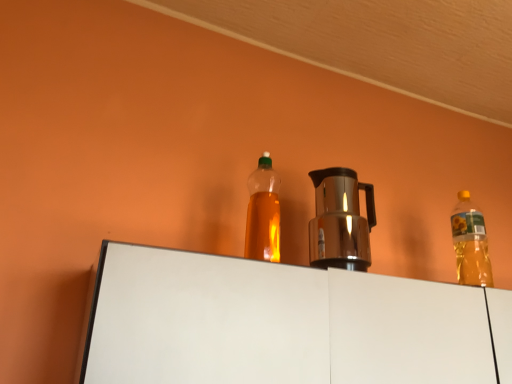
Question: Considering the relative positions of translucent plastic bottle at upper right, the 2th bottle when ordered from left to right, and shiny metallic coffee pot at center in the image provided, is translucent plastic bottle at upper right, the 2th bottle when ordered from left to right, to the left of shiny metallic coffee pot at center from the viewer's perspective?

Choices:
 (A) yes
 (B) no

Answer: (B)

Question: Is translucent plastic bottle at upper right, the 2th bottle when ordered from left to right, in contact with shiny metallic coffee pot at center?

Choices:
 (A) yes
 (B) no

Answer: (B)

Question: Is translucent plastic bottle at upper right, the 2th bottle viewed from the front, bigger than shiny metallic coffee pot at center?

Choices:
 (A) yes
 (B) no

Answer: (B)

Question: Can you confirm if translucent plastic bottle at upper right, the first bottle when ordered from right to left, is thinner than shiny metallic coffee pot at center?

Choices:
 (A) yes
 (B) no

Answer: (A)

Question: From the image's perspective, is translucent plastic bottle at upper right, the first bottle when ordered from right to left, on top of shiny metallic coffee pot at center?

Choices:
 (A) yes
 (B) no

Answer: (B)

Question: Is translucent plastic bottle at upper right, the 2th bottle when ordered from left to right, behind shiny metallic coffee pot at center?

Choices:
 (A) yes
 (B) no

Answer: (A)

Question: From the image's perspective, does shiny metallic coffee pot at center appear higher than translucent plastic bottle at upper right, the 2th bottle viewed from the front?

Choices:
 (A) no
 (B) yes

Answer: (B)

Question: Is shiny metallic coffee pot at center facing away from translucent plastic bottle at upper right, the 2th bottle when ordered from left to right?

Choices:
 (A) no
 (B) yes

Answer: (A)

Question: Does shiny metallic coffee pot at center appear on the left side of translucent plastic bottle at upper right, the 2th bottle viewed from the front?

Choices:
 (A) no
 (B) yes

Answer: (B)

Question: Does shiny metallic coffee pot at center come in front of translucent plastic bottle at upper right, the 1th bottle from the back?

Choices:
 (A) no
 (B) yes

Answer: (B)

Question: Can you confirm if shiny metallic coffee pot at center is bigger than translucent plastic bottle at upper right, the 2th bottle viewed from the front?

Choices:
 (A) yes
 (B) no

Answer: (A)

Question: Is shiny metallic coffee pot at center not inside translucent plastic bottle at upper right, the first bottle when ordered from right to left?

Choices:
 (A) no
 (B) yes

Answer: (B)

Question: From the image's perspective, is translucent plastic bottle at upper right, the first bottle when ordered from right to left, below translucent plastic bottle at center, the 1th bottle when ordered from front to back?

Choices:
 (A) no
 (B) yes

Answer: (B)